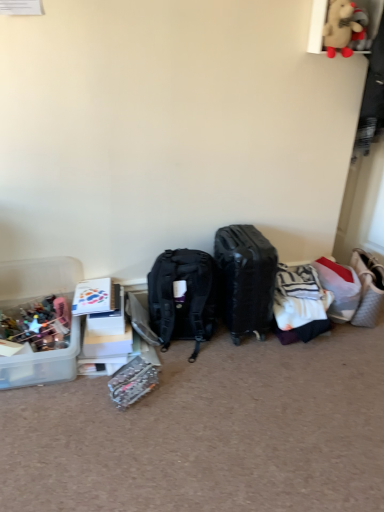
Question: From a real-world perspective, is fluffy beige teddy bear at upper right physically below white quilted fabric handbag at right?

Choices:
 (A) no
 (B) yes

Answer: (A)

Question: Is white quilted fabric handbag at right surrounded by fluffy beige teddy bear at upper right?

Choices:
 (A) yes
 (B) no

Answer: (B)

Question: From a real-world perspective, is fluffy beige teddy bear at upper right positioned over white quilted fabric handbag at right based on gravity?

Choices:
 (A) yes
 (B) no

Answer: (A)

Question: Are fluffy beige teddy bear at upper right and white quilted fabric handbag at right located far from each other?

Choices:
 (A) no
 (B) yes

Answer: (B)

Question: Does fluffy beige teddy bear at upper right have a lesser width compared to white quilted fabric handbag at right?

Choices:
 (A) no
 (B) yes

Answer: (B)

Question: In the image, is white striped fabric at center-right positioned in front of or behind fluffy beige teddy bear at upper right?

Choices:
 (A) behind
 (B) front

Answer: (A)

Question: From the image's perspective, is white striped fabric at center-right above or below fluffy beige teddy bear at upper right?

Choices:
 (A) above
 (B) below

Answer: (B)

Question: In terms of size, does white striped fabric at center-right appear bigger or smaller than fluffy beige teddy bear at upper right?

Choices:
 (A) big
 (B) small

Answer: (A)

Question: Is point (314, 282) closer or farther from the camera than point (355, 26)?

Choices:
 (A) farther
 (B) closer

Answer: (A)

Question: Considering the positions of clear plastic kit at lower center and white plastic storage box at left in the image, is clear plastic kit at lower center bigger or smaller than white plastic storage box at left?

Choices:
 (A) big
 (B) small

Answer: (A)

Question: From a real-world perspective, is clear plastic kit at lower center physically located above or below white plastic storage box at left?

Choices:
 (A) below
 (B) above

Answer: (A)

Question: Considering their positions, is clear plastic kit at lower center located in front of or behind white plastic storage box at left?

Choices:
 (A) front
 (B) behind

Answer: (A)

Question: Based on their positions, is clear plastic kit at lower center located to the left or right of white plastic storage box at left?

Choices:
 (A) left
 (B) right

Answer: (B)

Question: Does point (74, 331) appear closer or farther from the camera than point (357, 266)?

Choices:
 (A) farther
 (B) closer

Answer: (B)

Question: Would you say translucent plastic container at lower left is inside or outside white quilted fabric handbag at right?

Choices:
 (A) inside
 (B) outside

Answer: (B)